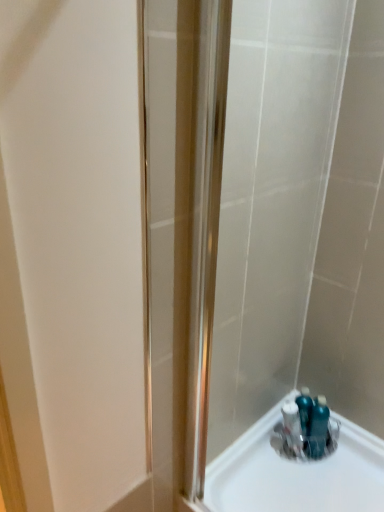
Image resolution: width=384 pixels, height=512 pixels. What are the coordinates of `vacant region to the right of blue glossy bottles at bottom right, which is the first sink from right to left` in the screenshot? It's located at coord(355,455).